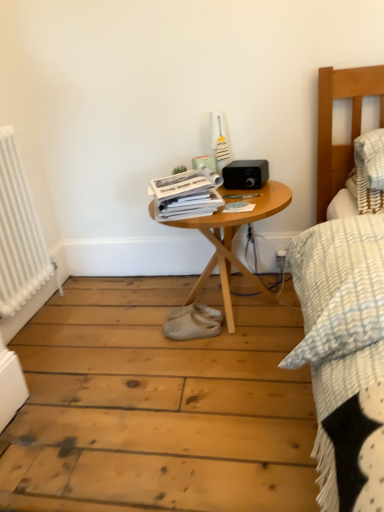
Question: Looking at the image, does white glossy magazine at center, which ranks as the second magazine in right-to-left order, seem bigger or smaller compared to white suede shoe at center?

Choices:
 (A) big
 (B) small

Answer: (A)

Question: Considering the relative positions of white glossy magazine at center, arranged as the first magazine when viewed from the left, and white suede shoe at center in the image provided, is white glossy magazine at center, arranged as the first magazine when viewed from the left, to the left or to the right of white suede shoe at center?

Choices:
 (A) left
 (B) right

Answer: (A)

Question: Which of these objects is positioned farthest from the matte paper magazine at center, which ranks as the 2th magazine in left-to-right order?

Choices:
 (A) white glossy magazine at center, which ranks as the second magazine in right-to-left order
 (B) white metallic radiator at left
 (C) white suede shoe at center
 (D) woodenobject at center
 (E) white plastic electric outlet at lower right

Answer: (B)

Question: Considering the real-world distances, which object is closest to the white metallic radiator at left?

Choices:
 (A) white suede shoe at center
 (B) matte paper magazine at center, which is counted as the 1th magazine, starting from the right
 (C) white plastic electric outlet at lower right
 (D) woodenobject at center
 (E) white glossy magazine at center, arranged as the first magazine when viewed from the left

Answer: (E)